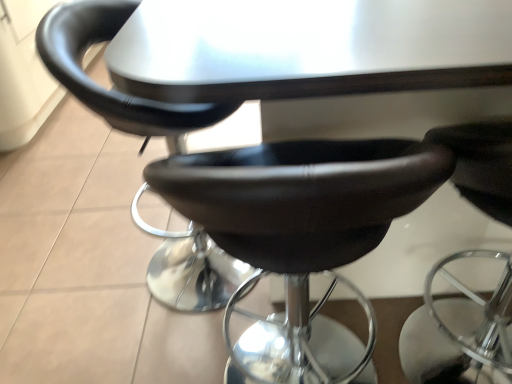
What do you see at coordinates (459, 330) in the screenshot?
I see `black leather chair at center, the third chair when ordered from left to right` at bounding box center [459, 330].

Describe the element at coordinates (112, 89) in the screenshot. I see `matte black stool at center, acting as the first chair starting from the left` at that location.

Image resolution: width=512 pixels, height=384 pixels. What are the coordinates of `black leather chair at center, the third chair when ordered from left to right` in the screenshot? It's located at (459, 330).

At what (x,y) coordinates should I click in order to perform the action: click on the 1st chair behind the black leather chair at center, the third chair when ordered from left to right. Please return your answer as a coordinate pair (x, y). The image size is (512, 384). Looking at the image, I should click on (302, 184).

Visually, is black leather stool at center, acting as the 2th chair starting from the left, positioned to the left or to the right of black leather chair at center, placed as the 1th chair when sorted from right to left?

From the image, it's evident that black leather stool at center, acting as the 2th chair starting from the left, is to the left of black leather chair at center, placed as the 1th chair when sorted from right to left.

Does point (204, 163) appear closer or farther from the camera than point (489, 142)?

Point (204, 163) appears to be closer to the viewer than point (489, 142).

Is black leather stool at center, which is counted as the second chair, starting from the right, turned away from black leather chair at center, the third chair when ordered from left to right?

That's not correct — black leather stool at center, which is counted as the second chair, starting from the right, is not looking away from black leather chair at center, the third chair when ordered from left to right.

Does matte black stool at center, which is counted as the 3th chair, starting from the right, have a lesser height compared to black leather stool at center, which is counted as the second chair, starting from the right?

No.

From a real-world perspective, is matte black stool at center, which is counted as the 3th chair, starting from the right, physically above black leather stool at center, acting as the 2th chair starting from the left?

Yes.

From the image's perspective, is matte black stool at center, which is counted as the 3th chair, starting from the right, on top of black leather stool at center, which is counted as the second chair, starting from the right?

Yes, from the image's perspective, matte black stool at center, which is counted as the 3th chair, starting from the right, is above black leather stool at center, which is counted as the second chair, starting from the right.

Starting from the black leather chair at center, the third chair when ordered from left to right, which chair is the 1st one behind? Please provide its 2D coordinates.

[(302, 184)]

Which is more to the left, black leather chair at center, the third chair when ordered from left to right, or black leather stool at center, acting as the 2th chair starting from the left?

Positioned to the left is black leather stool at center, acting as the 2th chair starting from the left.

Which of these two, black leather chair at center, placed as the 1th chair when sorted from right to left, or black leather stool at center, which is counted as the second chair, starting from the right, stands shorter?

Standing shorter between the two is black leather chair at center, placed as the 1th chair when sorted from right to left.

Would you consider black leather chair at center, placed as the 1th chair when sorted from right to left, to be distant from matte black stool at center, which is counted as the 3th chair, starting from the right?

No.

Is black leather chair at center, the third chair when ordered from left to right, thinner than matte black stool at center, acting as the first chair starting from the left?

No.

In the image, is black leather chair at center, the third chair when ordered from left to right, positioned in front of or behind matte black stool at center, which is counted as the 3th chair, starting from the right?

black leather chair at center, the third chair when ordered from left to right, is positioned closer to the viewer than matte black stool at center, which is counted as the 3th chair, starting from the right.

Which of these two, black leather stool at center, which is counted as the second chair, starting from the right, or matte black stool at center, acting as the first chair starting from the left, is bigger?

matte black stool at center, acting as the first chair starting from the left, is bigger.

From the image's perspective, is black leather stool at center, acting as the 2th chair starting from the left, above or below matte black stool at center, which is counted as the 3th chair, starting from the right?

Clearly, from the image's perspective, black leather stool at center, acting as the 2th chair starting from the left, is below matte black stool at center, which is counted as the 3th chair, starting from the right.

Is black leather stool at center, acting as the 2th chair starting from the left, turned away from matte black stool at center, which is counted as the 3th chair, starting from the right?

That's not correct — black leather stool at center, acting as the 2th chair starting from the left, is not looking away from matte black stool at center, which is counted as the 3th chair, starting from the right.

Does black leather stool at center, acting as the 2th chair starting from the left, have a greater width compared to matte black stool at center, which is counted as the 3th chair, starting from the right?

Incorrect, the width of black leather stool at center, acting as the 2th chair starting from the left, does not surpass that of matte black stool at center, which is counted as the 3th chair, starting from the right.

Which is behind, matte black stool at center, which is counted as the 3th chair, starting from the right, or black leather chair at center, placed as the 1th chair when sorted from right to left?

matte black stool at center, which is counted as the 3th chair, starting from the right, is further away from the camera.

From the image's perspective, is matte black stool at center, which is counted as the 3th chair, starting from the right, positioned above or below black leather chair at center, the third chair when ordered from left to right?

Clearly, from the image's perspective, matte black stool at center, which is counted as the 3th chair, starting from the right, is above black leather chair at center, the third chair when ordered from left to right.

From a real-world perspective, which object stands above the other?

matte black stool at center, acting as the first chair starting from the left.

The width and height of the screenshot is (512, 384). Identify the location of chair in front of the black leather stool at center, which is counted as the second chair, starting from the right. (459, 330).

The height and width of the screenshot is (384, 512). Find the location of `chair behind the black leather stool at center, acting as the 2th chair starting from the left`. chair behind the black leather stool at center, acting as the 2th chair starting from the left is located at coordinates (112, 89).

From the image, which object appears to be farther from matte black stool at center, acting as the first chair starting from the left, black leather chair at center, the third chair when ordered from left to right, or black leather stool at center, which is counted as the second chair, starting from the right?

The object further to matte black stool at center, acting as the first chair starting from the left, is black leather chair at center, the third chair when ordered from left to right.

In the scene shown: Considering their positions, is black leather chair at center, the third chair when ordered from left to right, positioned closer to black leather stool at center, which is counted as the second chair, starting from the right, than matte black stool at center, acting as the first chair starting from the left?

The object closer to black leather stool at center, which is counted as the second chair, starting from the right, is matte black stool at center, acting as the first chair starting from the left.

Looking at this image, which object lies further to the anchor point black leather stool at center, acting as the 2th chair starting from the left, matte black stool at center, which is counted as the 3th chair, starting from the right, or black leather chair at center, the third chair when ordered from left to right?

Among the two, black leather chair at center, the third chair when ordered from left to right, is located further to black leather stool at center, acting as the 2th chair starting from the left.

Considering their positions, is black leather stool at center, which is counted as the second chair, starting from the right, positioned further to black leather chair at center, placed as the 1th chair when sorted from right to left, than matte black stool at center, which is counted as the 3th chair, starting from the right?

Among the two, matte black stool at center, which is counted as the 3th chair, starting from the right, is located further to black leather chair at center, placed as the 1th chair when sorted from right to left.

Based on their spatial positions, is matte black stool at center, which is counted as the 3th chair, starting from the right, or black leather stool at center, which is counted as the second chair, starting from the right, further from black leather chair at center, the third chair when ordered from left to right?

Based on the image, matte black stool at center, which is counted as the 3th chair, starting from the right, appears to be further to black leather chair at center, the third chair when ordered from left to right.

From the image, which object appears to be farther from matte black stool at center, acting as the first chair starting from the left, black leather stool at center, acting as the 2th chair starting from the left, or black leather chair at center, the third chair when ordered from left to right?

black leather chair at center, the third chair when ordered from left to right, lies further to matte black stool at center, acting as the first chair starting from the left, than the other object.

This screenshot has height=384, width=512. I want to click on chair situated between matte black stool at center, acting as the first chair starting from the left, and black leather chair at center, placed as the 1th chair when sorted from right to left, from left to right, so click(x=302, y=184).